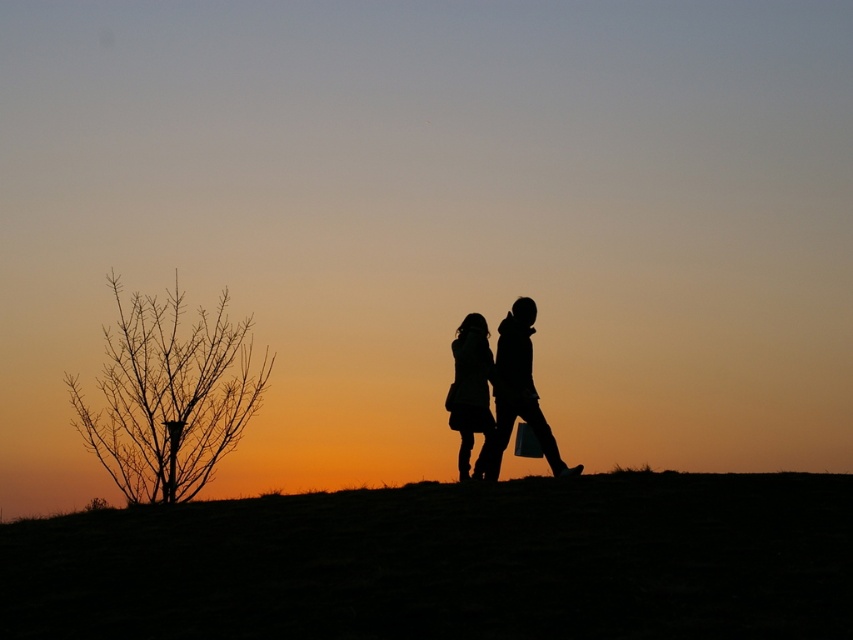
Question: Which object appears farthest from the camera in this image?

Choices:
 (A) silhouette dress at center
 (B) silhouette clothing at center
 (C) dark grass at center

Answer: (A)

Question: Which point appears farthest from the camera in this image?

Choices:
 (A) (482, 352)
 (B) (158, 556)

Answer: (A)

Question: Considering the relative positions of dark grass at center and silhouette dress at center in the image provided, where is dark grass at center located with respect to silhouette dress at center?

Choices:
 (A) left
 (B) right

Answer: (A)

Question: Can you confirm if dark grass at center is positioned above silhouette clothing at center?

Choices:
 (A) yes
 (B) no

Answer: (B)

Question: Which is nearer to the silhouette clothing at center?

Choices:
 (A) silhouette dress at center
 (B) dark grass at center

Answer: (A)

Question: Is dark grass at center below silhouette clothing at center?

Choices:
 (A) yes
 (B) no

Answer: (A)